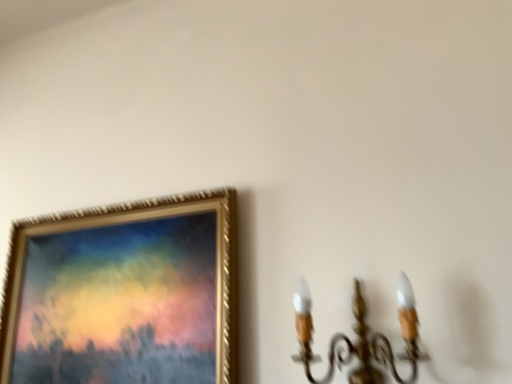
Question: Looking at the image, does gold metallic chandelier at right seem bigger or smaller compared to gold textured frame at upper left?

Choices:
 (A) big
 (B) small

Answer: (B)

Question: Relative to gold textured frame at upper left, is gold metallic chandelier at right in front or behind?

Choices:
 (A) behind
 (B) front

Answer: (B)

Question: From a real-world perspective, relative to gold textured frame at upper left, is gold metallic chandelier at right vertically above or below?

Choices:
 (A) above
 (B) below

Answer: (B)

Question: Is gold textured frame at upper left spatially inside gold metallic chandelier at right, or outside of it?

Choices:
 (A) inside
 (B) outside

Answer: (B)

Question: Relative to gold metallic chandelier at right, is gold textured frame at upper left in front or behind?

Choices:
 (A) front
 (B) behind

Answer: (B)

Question: From the image's perspective, relative to gold metallic chandelier at right, is gold textured frame at upper left above or below?

Choices:
 (A) above
 (B) below

Answer: (B)

Question: From a real-world perspective, is gold textured frame at upper left above or below gold metallic chandelier at right?

Choices:
 (A) above
 (B) below

Answer: (A)